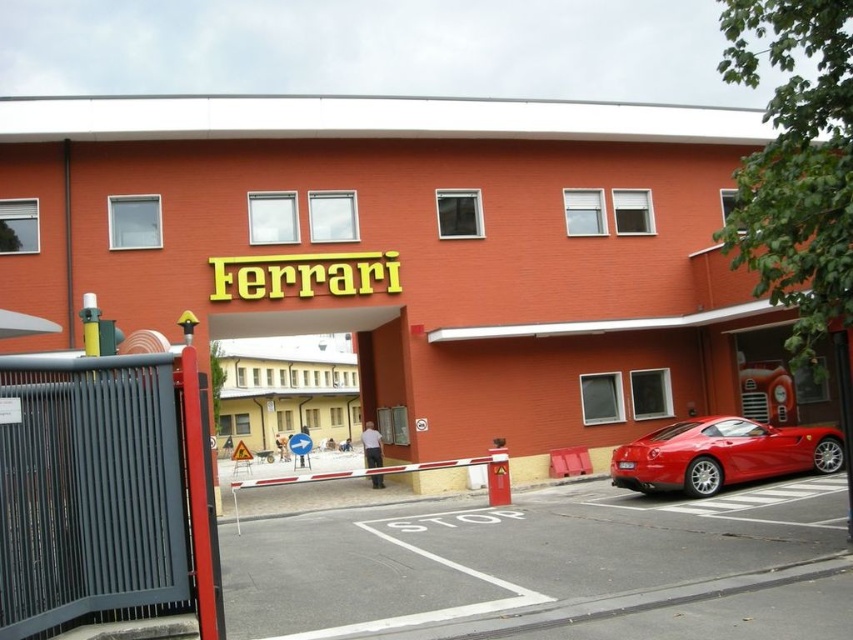
You are a delivery driver arriving at the Ferrari facility entrance. You need to park your truck, which is 7 meters long, in the parking spot near the glossy red car at right and the glossy red sports car at lower right. Can your truck fit in the parking spot if the space between them is exactly 8 meters?

The glossy red car at right is larger in size than the glossy red sports car at lower right. However, the distance between them is 8 meters. Since the truck is 7 meters long, it can fit in the parking spot as the space is sufficient to accommodate its length.

You are a delivery driver approaching the Ferrari facility entrance. You need to park your vehicle near the glossy red car at right and the glossy red sports car at lower right. According to the scene description, which car is positioned lower, requiring you to park closer to the ground?

The glossy red car at right is located below the glossy red sports car at lower right, so you should park closer to the ground near the glossy red car at right.

You are a delivery driver arriving at the Ferrari facility entrance. You need to park your truck, which is 10 meters long, in the parking area near the entrance. Considering the space between the glossy red car at right and the metallic gate at center, can your truck fit there?

The glossy red car at right has a larger size compared to metallic gate at center. However, the exact distance between them isn t provided in the description, so it s impossible to determine if the truck can fit there based on the given information.